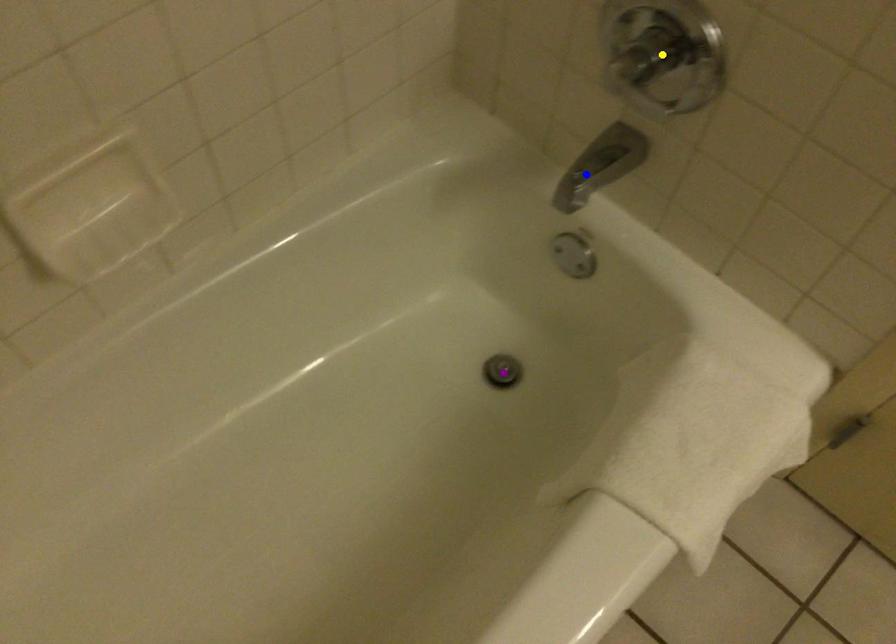
Looking at this image, order these from nearest to farthest:
- purple point
- yellow point
- blue point

yellow point, blue point, purple point